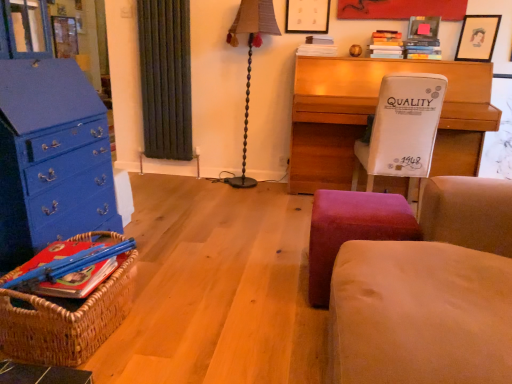
Question: From a real-world perspective, is matte black picture frame at upper center, the 3th picture frame from the right, physically located above or below beige fabric rocking chair at right?

Choices:
 (A) below
 (B) above

Answer: (B)

Question: In the image, is matte black picture frame at upper center, the 3th picture frame from the right, positioned in front of or behind beige fabric rocking chair at right?

Choices:
 (A) front
 (B) behind

Answer: (B)

Question: Which object is positioned farthest from the wooden desk at center?

Choices:
 (A) brown fabric lampshade at center
 (B) matte black picture frame at upper right, acting as the 2th picture frame starting from the left
 (C) matte black picture frame at upper right, the third picture frame in the left-to-right sequence
 (D) woven brown basket at lower left
 (E) matte black picture frame at upper center, the 3th picture frame from the right

Answer: (D)

Question: Estimate the real-world distances between objects in this image. Which object is closer to the beige fabric rocking chair at right?

Choices:
 (A) blue painted wood chest of drawers at left
 (B) velvet red stool at lower center
 (C) wooden desk at center
 (D) woven brown basket at lower left
 (E) brown fabric lampshade at center

Answer: (B)